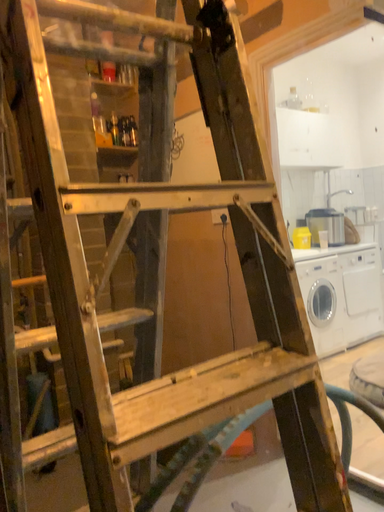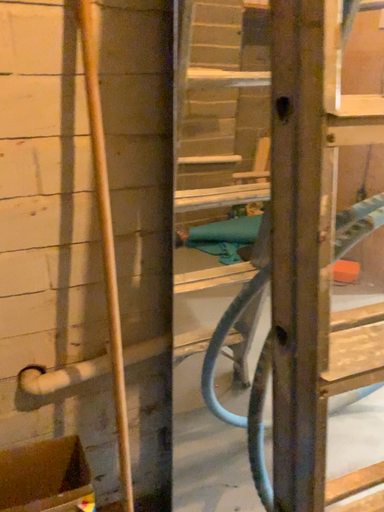
Question: Which way did the camera rotate in the video?

Choices:
 (A) rotated right
 (B) rotated left

Answer: (B)